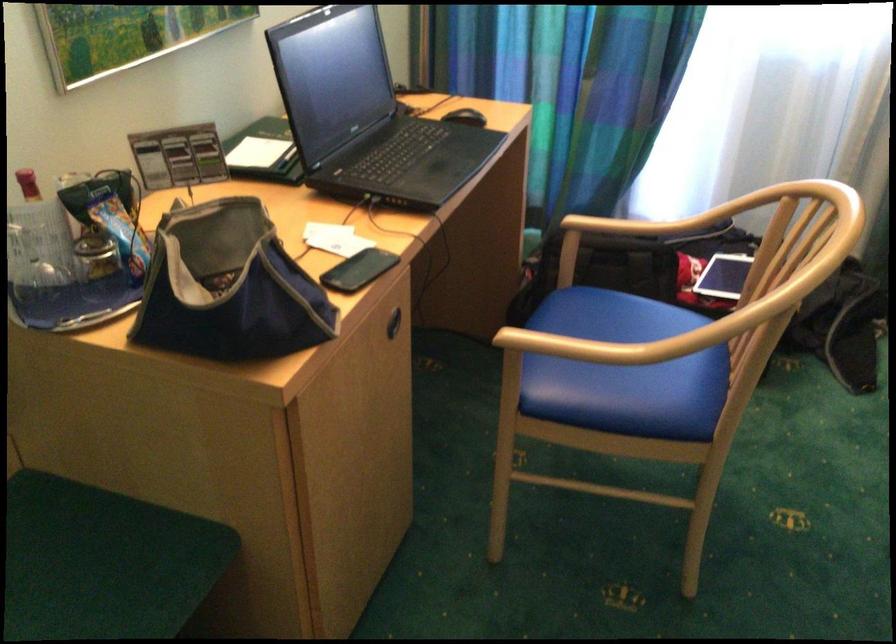
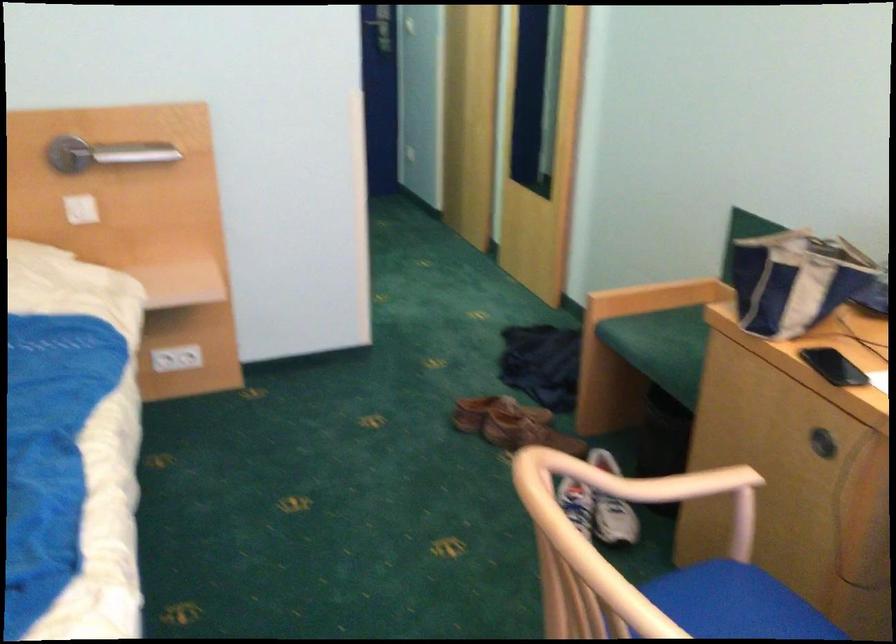
Where in the second image is the point corresponding to (574,393) from the first image?

(711, 590)